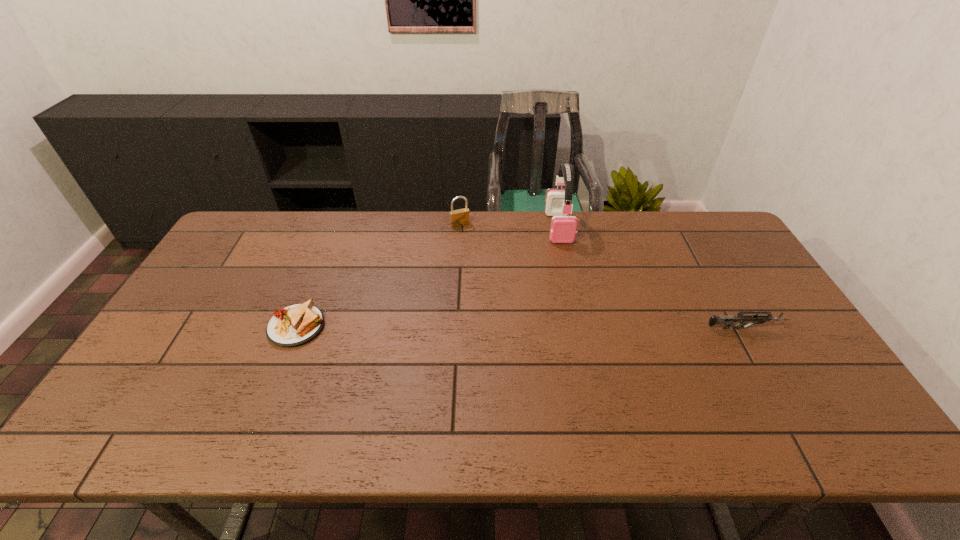
I want to click on vacant space located 0.160m on the front-facing side of the third object from right to left, so pyautogui.click(x=478, y=255).

The width and height of the screenshot is (960, 540). What are the coordinates of `free space located on the front-facing side of the third object from right to left` in the screenshot? It's located at (497, 289).

The image size is (960, 540). What are the coordinates of `vacant space located 0.160m on the outer surface of the earphone` in the screenshot? It's located at (568, 277).

Find the location of a particular element. The height and width of the screenshot is (540, 960). blank space located on the outer surface of the earphone is located at coordinates (570, 286).

Identify the location of vacant space located on the outer surface of the earphone. This screenshot has height=540, width=960. (578, 327).

Locate an element on the screen. padlock that is at the far edge is located at coordinates (460, 217).

I want to click on earphone that is positioned at the far edge, so click(563, 228).

Where is `object situated at the right edge`? Image resolution: width=960 pixels, height=540 pixels. object situated at the right edge is located at coordinates (727, 321).

In the image, there is a desktop. Identify the location of vacant region at the far edge. (414, 225).

What are the coordinates of `vacant space at the near edge of the desktop` in the screenshot? It's located at (665, 376).